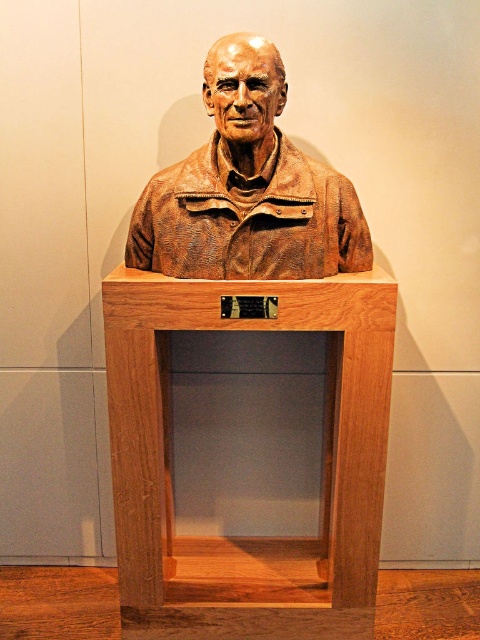
Question: Can you confirm if wooden podium at center is wider than bronze statue at center?

Choices:
 (A) no
 (B) yes

Answer: (B)

Question: Does wooden podium at center have a greater width compared to bronze statue at center?

Choices:
 (A) yes
 (B) no

Answer: (A)

Question: Considering the relative positions of wooden podium at center and bronze statue at center in the image provided, where is wooden podium at center located with respect to bronze statue at center?

Choices:
 (A) above
 (B) below

Answer: (B)

Question: Which object appears closest to the camera in this image?

Choices:
 (A) wooden podium at center
 (B) bronze statue at center

Answer: (B)

Question: Which object appears closest to the camera in this image?

Choices:
 (A) bronze statue at center
 (B) wooden podium at center

Answer: (A)

Question: Which of the following is the closest to the observer?

Choices:
 (A) (362, 406)
 (B) (253, 243)

Answer: (B)